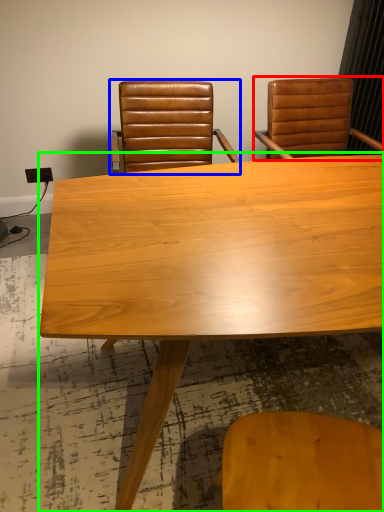
Question: Which object is positioned farthest from chair (highlighted by a red box)? Select from chair (highlighted by a blue box) and table (highlighted by a green box).

Choices:
 (A) chair
 (B) table

Answer: (B)